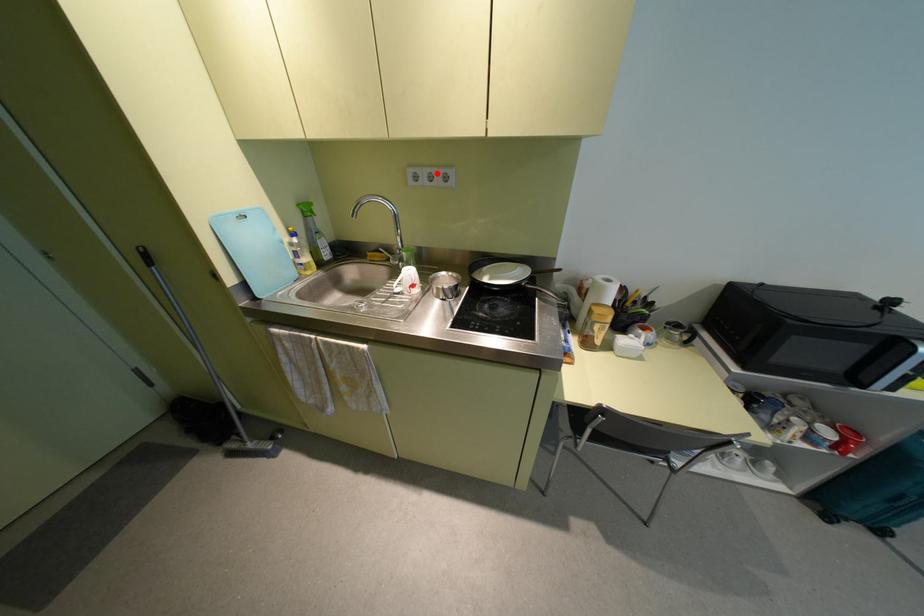
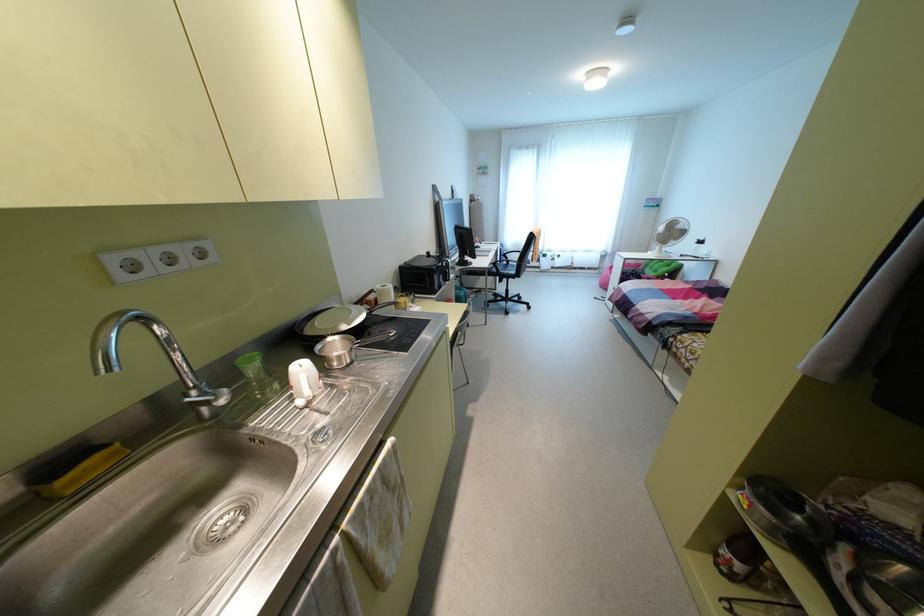
The point at the highlighted location is marked in the first image. Where is the corresponding point in the second image?

(181, 251)